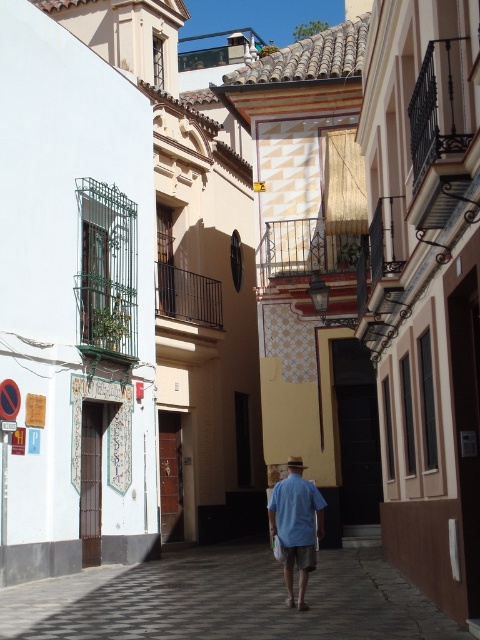
Is checkerboard tile pavement at center above blue cotton shirt at center?

Incorrect, checkerboard tile pavement at center is not positioned above blue cotton shirt at center.

Who is more distant from viewer, (97, 611) or (312, 524)?

Point (312, 524)

Identify the location of checkerboard tile pavement at center. (226, 600).